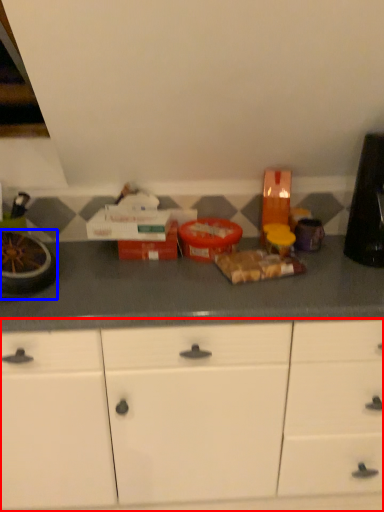
Question: Which of the following is the farthest to the observer, cabinetry (highlighted by a red box) or appliance (highlighted by a blue box)?

Choices:
 (A) cabinetry
 (B) appliance

Answer: (B)